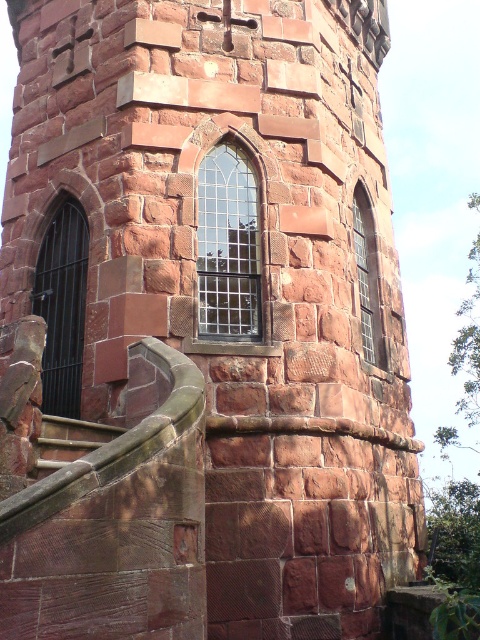
Question: Is black metal window at left to the right of clear glass window at center-right from the viewer's perspective?

Choices:
 (A) yes
 (B) no

Answer: (B)

Question: Which point is farther from the camera taking this photo?

Choices:
 (A) (369, 320)
 (B) (64, 262)
 (C) (257, 189)
 (D) (73, 440)

Answer: (A)

Question: Among these objects, which one is farthest from the camera?

Choices:
 (A) brown stone stairs at lower left
 (B) clear glass window at center-right

Answer: (B)

Question: Estimate the real-world distances between objects in this image. Which object is closer to the black metal window at left?

Choices:
 (A) clear glass window at center-right
 (B) brown stone stairs at lower left
 (C) clear glass window at center

Answer: (C)

Question: Is the position of clear glass window at center less distant than that of brown stone stairs at lower left?

Choices:
 (A) no
 (B) yes

Answer: (A)

Question: Does black metal window at left appear on the right side of clear glass window at center-right?

Choices:
 (A) yes
 (B) no

Answer: (B)